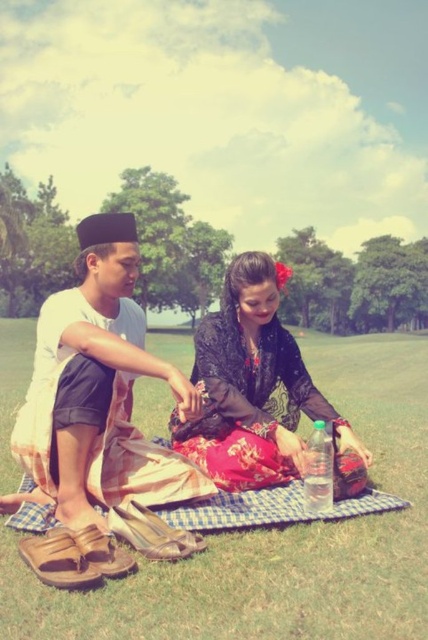
Can you confirm if green grass at center is positioned above silky black dress at center?

Actually, green grass at center is below silky black dress at center.

Can you confirm if green grass at center is positioned to the left of silky black dress at center?

No, green grass at center is not to the left of silky black dress at center.

Between point (253, 618) and point (291, 376), which one is positioned behind?

The point (291, 376) is behind.

Where is `green grass at center`? The image size is (428, 640). green grass at center is located at coordinates (279, 540).

Is green grass at center taller than brown leather sandals at lower left?

Yes, green grass at center is taller than brown leather sandals at lower left.

Does point (9, 582) lie in front of point (97, 406)?

Yes.

The width and height of the screenshot is (428, 640). I want to click on green grass at center, so click(279, 540).

Is point (113, 408) less distant than point (288, 339)?

Yes, it is.

Who is lower down, brown leather sandals at lower left or silky black dress at center?

brown leather sandals at lower left

Measure the distance between brown leather sandals at lower left and camera.

The distance of brown leather sandals at lower left from camera is 1.84 meters.

Locate an element on the screen. The height and width of the screenshot is (640, 428). brown leather sandals at lower left is located at coordinates (101, 419).